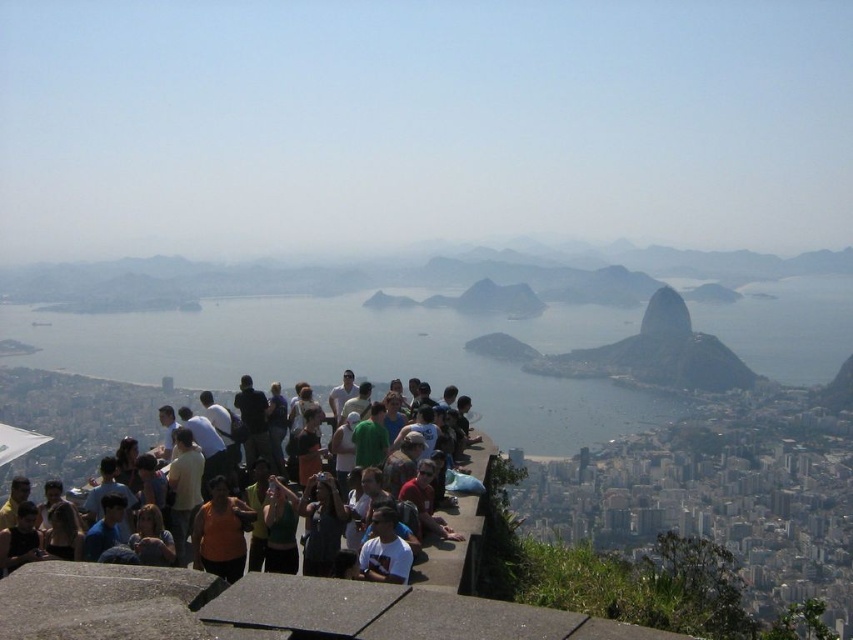
Question: Can you confirm if multicolored casual clothing at center is wider than green matte rock at center?

Choices:
 (A) yes
 (B) no

Answer: (A)

Question: Based on their relative distances, which object is nearer to the multicolored casual clothing at center?

Choices:
 (A) clear water at center
 (B) denim jacket at lower left
 (C) matte black camera at center
 (D) orange fabric shirt at center

Answer: (A)

Question: Is orange fabric shirt at center wider than matte black camera at center?

Choices:
 (A) no
 (B) yes

Answer: (B)

Question: Among these objects, which one is farthest from the camera?

Choices:
 (A) multicolored casual clothing at center
 (B) denim jacket at lower left
 (C) orange fabric shirt at center
 (D) matte black camera at center

Answer: (D)

Question: Does multicolored casual clothing at center have a greater width compared to matte black camera at center?

Choices:
 (A) yes
 (B) no

Answer: (A)

Question: Which of the following is the farthest from the observer?

Choices:
 (A) green matte rock at center
 (B) multicolored casual clothing at center
 (C) clear water at center
 (D) denim jacket at lower left

Answer: (A)